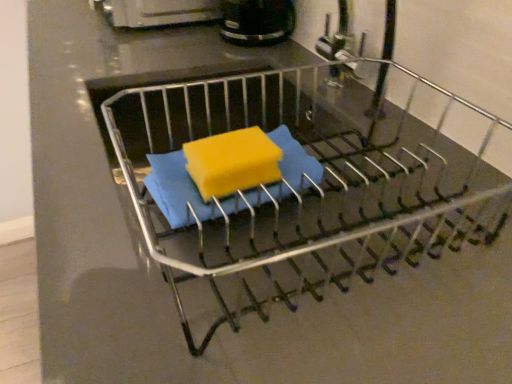
Question: Considering the relative sizes of yellow sponge at center and metallic dish rack at center in the image provided, is yellow sponge at center shorter than metallic dish rack at center?

Choices:
 (A) yes
 (B) no

Answer: (A)

Question: Is yellow sponge at center in front of metallic dish rack at center?

Choices:
 (A) yes
 (B) no

Answer: (B)

Question: From a real-world perspective, is yellow sponge at center over metallic dish rack at center?

Choices:
 (A) no
 (B) yes

Answer: (B)

Question: Is yellow sponge at center positioned beyond the bounds of metallic dish rack at center?

Choices:
 (A) yes
 (B) no

Answer: (B)

Question: Is yellow sponge at center turned away from metallic dish rack at center?

Choices:
 (A) no
 (B) yes

Answer: (B)

Question: From a real-world perspective, is metallic dish rack at center positioned above or below yellow sponge at center?

Choices:
 (A) below
 (B) above

Answer: (A)

Question: Is metallic dish rack at center inside or outside of yellow sponge at center?

Choices:
 (A) inside
 (B) outside

Answer: (B)

Question: In terms of width, does metallic dish rack at center look wider or thinner when compared to yellow sponge at center?

Choices:
 (A) wide
 (B) thin

Answer: (A)

Question: From their relative heights in the image, would you say metallic dish rack at center is taller or shorter than yellow sponge at center?

Choices:
 (A) tall
 (B) short

Answer: (A)

Question: Considering the positions of yellow sponge at center and black plastic coffee maker at upper center in the image, is yellow sponge at center bigger or smaller than black plastic coffee maker at upper center?

Choices:
 (A) big
 (B) small

Answer: (B)

Question: From a real-world perspective, is yellow sponge at center above or below black plastic coffee maker at upper center?

Choices:
 (A) above
 (B) below

Answer: (B)

Question: Is yellow sponge at center situated inside black plastic coffee maker at upper center or outside?

Choices:
 (A) inside
 (B) outside

Answer: (B)

Question: Considering the positions of point (263, 140) and point (227, 18), is point (263, 140) closer or farther from the camera than point (227, 18)?

Choices:
 (A) closer
 (B) farther

Answer: (A)

Question: In terms of height, does metallic dish rack at center look taller or shorter compared to black plastic coffee maker at upper center?

Choices:
 (A) tall
 (B) short

Answer: (B)

Question: Is metallic dish rack at center inside or outside of black plastic coffee maker at upper center?

Choices:
 (A) inside
 (B) outside

Answer: (B)